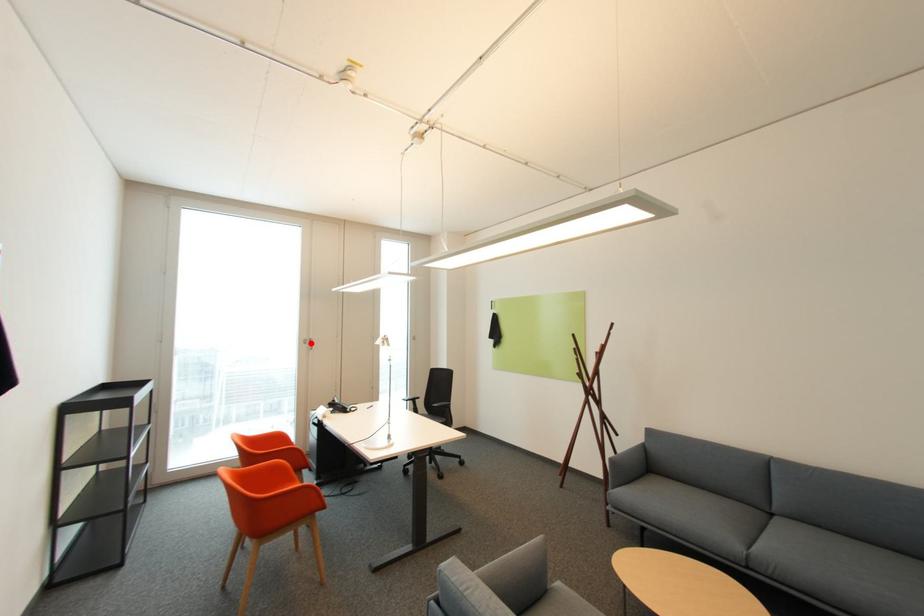
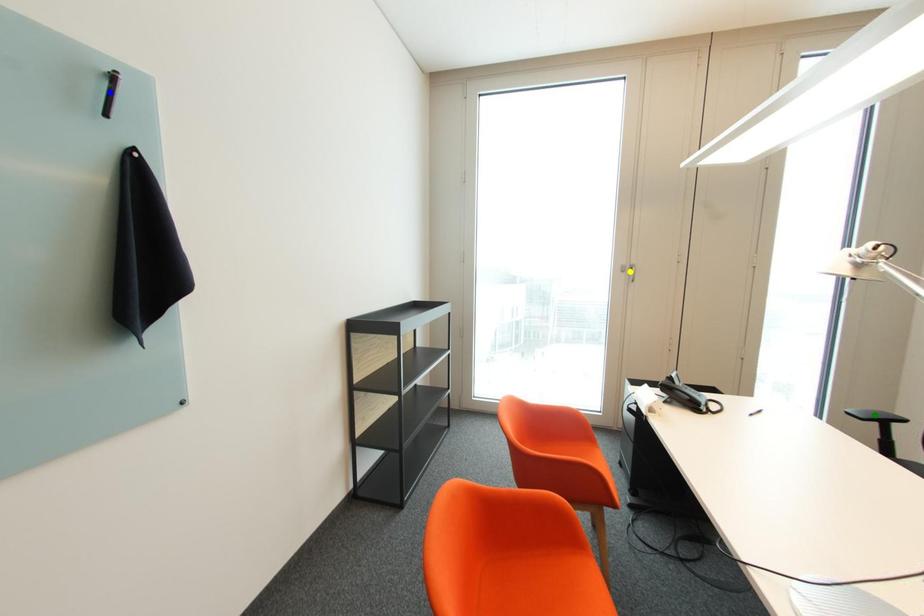
Question: I am providing you with two images of the same scene from different viewpoints. A red point is marked on the first image. You are given multiple points on the second image. Which spot in image 2 lines up with the point in image 1?

Choices:
 (A) blue point
 (B) yellow point
 (C) green point

Answer: (B)